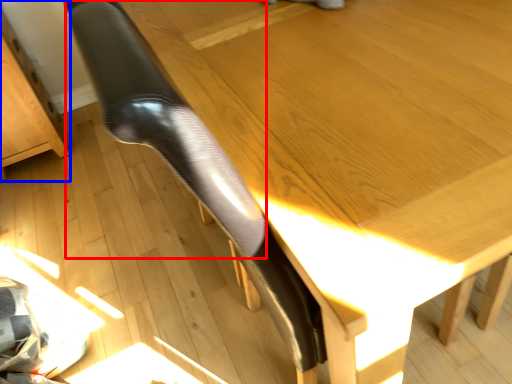
Question: Among these objects, which one is nearest to the camera, leg (highlighted by a red box) or furniture (highlighted by a blue box)?

Choices:
 (A) leg
 (B) furniture

Answer: (A)